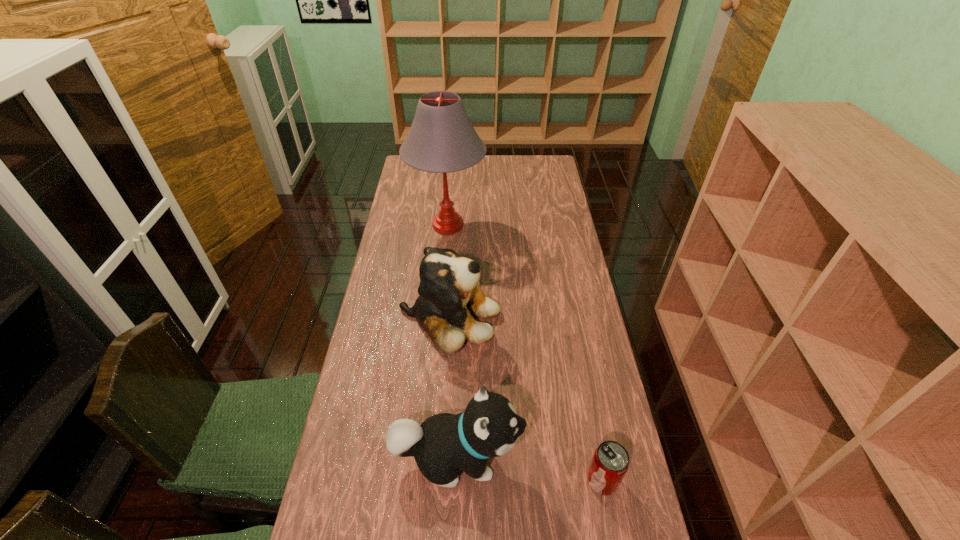
Find the location of a particular element. This screenshot has width=960, height=540. the farthest object is located at coordinates (442, 139).

What are the coordinates of `table lamp` in the screenshot? It's located at (442, 139).

Where is `the farther puppy`? the farther puppy is located at coordinates (449, 290).

Where is `the nearer puppy`? the nearer puppy is located at coordinates pyautogui.click(x=444, y=443).

Where is `the shortest object`? the shortest object is located at coordinates (610, 462).

This screenshot has width=960, height=540. What are the coordinates of `the rightmost object` in the screenshot? It's located at (610, 462).

Locate an element on the screen. This screenshot has width=960, height=540. free region located 0.110m on the front-facing side of the tallest object is located at coordinates click(513, 226).

At what (x,y) coordinates should I click in order to perform the action: click on free region located at the face of the third nearest object. Please return your answer as a coordinate pair (x, y). The image size is (960, 540). Looking at the image, I should click on (561, 318).

Identify the location of vacant space located at the face of the nearer puppy. (619, 457).

At what (x,y) coordinates should I click in order to perform the action: click on free space located 0.360m on the back of the shortest object. Please return your answer as a coordinate pair (x, y). Looking at the image, I should click on (577, 349).